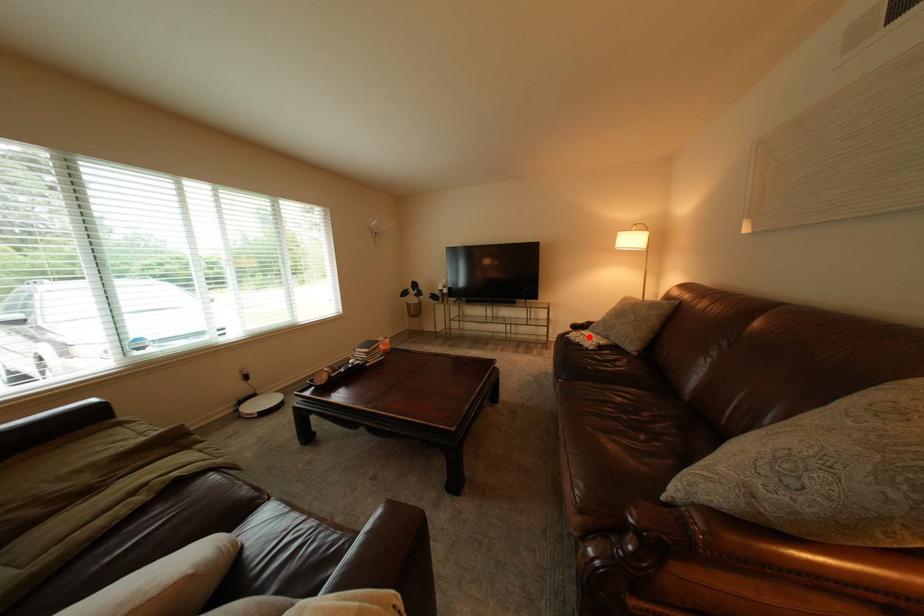
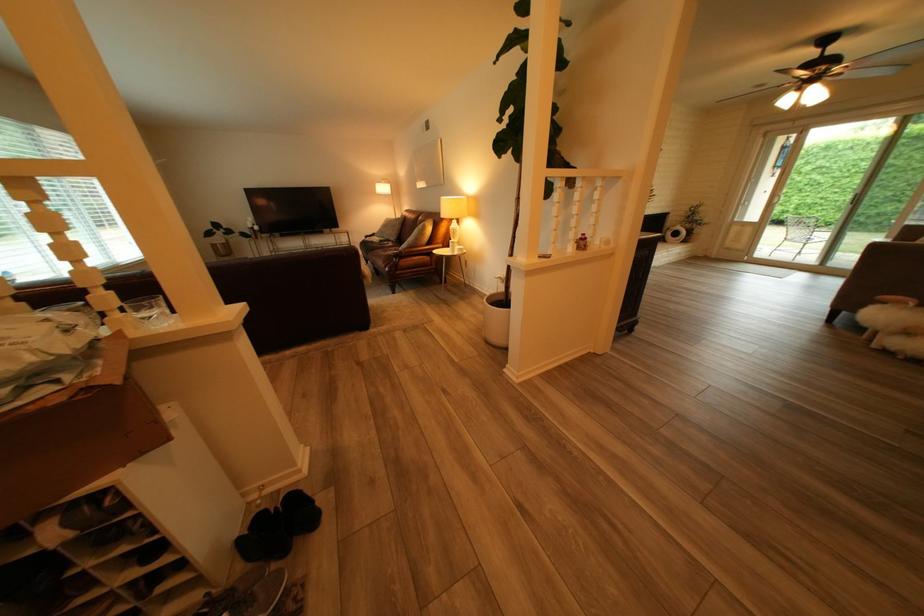
Question: A red point is marked in image1. In image2, is the corresponding 3D point closer to the camera or farther? Reply with the corresponding letter.

Choices:
 (A) The corresponding 3D point is closer.
 (B) The corresponding 3D point is farther.

Answer: (B)